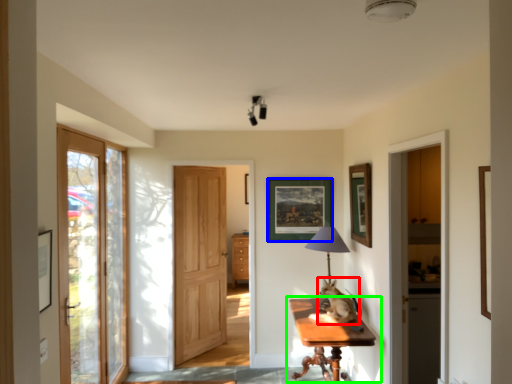
Question: Which object is positioned closest to cat (highlighted by a red box)? Select from picture frame (highlighted by a blue box) and table (highlighted by a green box).

Choices:
 (A) picture frame
 (B) table

Answer: (B)